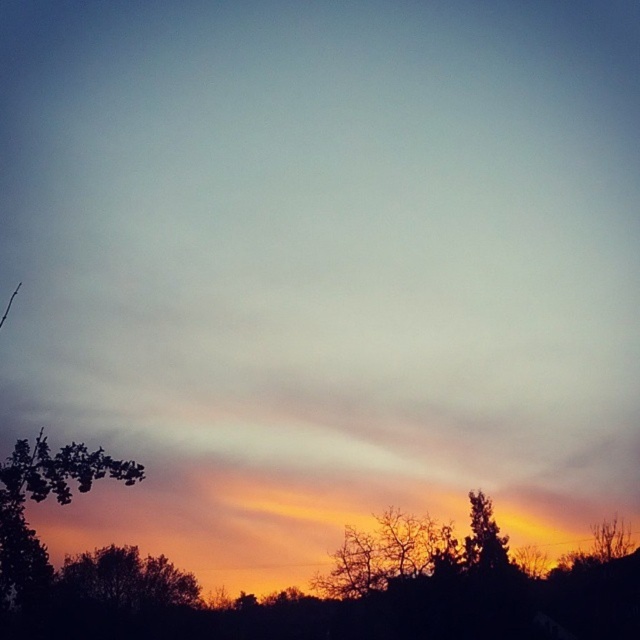
This screenshot has height=640, width=640. I want to click on silhouette bare tree at lower center, so click(385, 554).

Is green leafy tree at lower left thinner than silhouette bare tree at lower center?

No, green leafy tree at lower left is not thinner than silhouette bare tree at lower center.

Does green leafy tree at lower left have a greater width compared to silhouette bare tree at lower center?

Indeed, green leafy tree at lower left has a greater width compared to silhouette bare tree at lower center.

Who is more forward, (12, 570) or (406, 516)?

Point (12, 570) is in front.

You are a GUI agent. You are given a task and a screenshot of the screen. Output one action in this format:
    pyautogui.click(x=<x>, y=<y>)
    Task: Click on the green leafy tree at lower left
    
    Given the screenshot: What is the action you would take?
    pyautogui.click(x=42, y=500)

Describe the element at coordinates (42, 500) in the screenshot. This screenshot has width=640, height=640. I see `green leafy tree at lower left` at that location.

Is green leafy tree at lower left taller than silhouette tree at lower right?

Correct, green leafy tree at lower left is much taller as silhouette tree at lower right.

Does point (68, 464) come closer to viewer compared to point (468, 493)?

Yes, point (68, 464) is in front of point (468, 493).

Identify the location of green leafy tree at lower left. This screenshot has height=640, width=640. (42, 500).